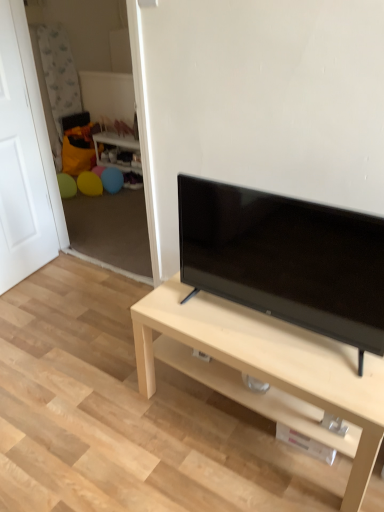
Identify the location of vacant region in front of white matte door at left. This screenshot has width=384, height=512. (37, 305).